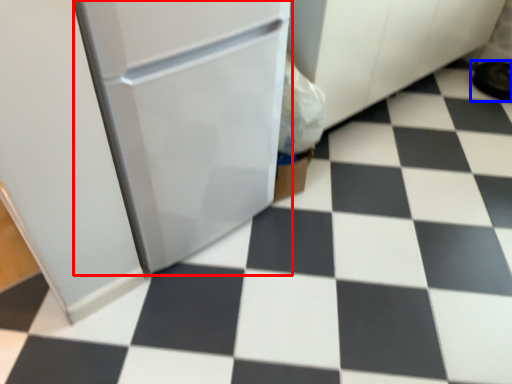
Question: Which object appears farthest to the camera in this image, appliance (highlighted by a red box) or footwear (highlighted by a blue box)?

Choices:
 (A) appliance
 (B) footwear

Answer: (B)